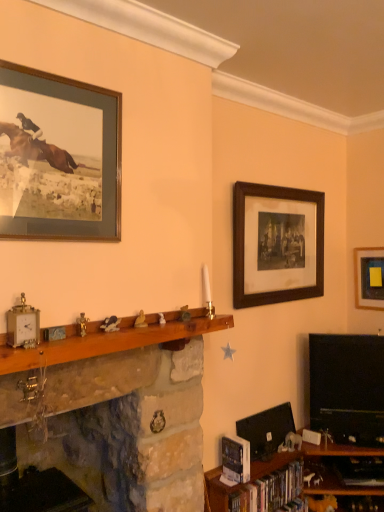
Question: From the image's perspective, is wooden shelf at lower right, arranged as the 3th shelf when viewed from the left, above or below black glossy television at right?

Choices:
 (A) above
 (B) below

Answer: (B)

Question: Considering the positions of wooden shelf at lower right, arranged as the 3th shelf when viewed from the left, and black glossy television at right in the image, is wooden shelf at lower right, arranged as the 3th shelf when viewed from the left, bigger or smaller than black glossy television at right?

Choices:
 (A) big
 (B) small

Answer: (A)

Question: Based on their relative distances, which object is farther from the wooden mantle at center, which is the 3th shelf from right to left?

Choices:
 (A) matte yellow paper at upper right, placed as the 3th picture frame when sorted from front to back
 (B) wooden at center, arranged as the second shelf when viewed from the left
 (C) wooden framed print at upper right, which appears as the second picture frame when viewed from the front
 (D) wooden shelf at lower right, which is counted as the 1th shelf, starting from the right
 (E) black glossy television at right

Answer: (A)

Question: Which object is the farthest from the wooden framed print at upper right, which is the 2th picture frame in back-to-front order?

Choices:
 (A) wooden at center, marked as the second shelf in a right-to-left arrangement
 (B) wooden shelf at lower right, which is counted as the 1th shelf, starting from the right
 (C) wooden mantle at center, acting as the 1th shelf starting from the left
 (D) hardcover books at lower right
 (E) black glossy television at right

Answer: (D)